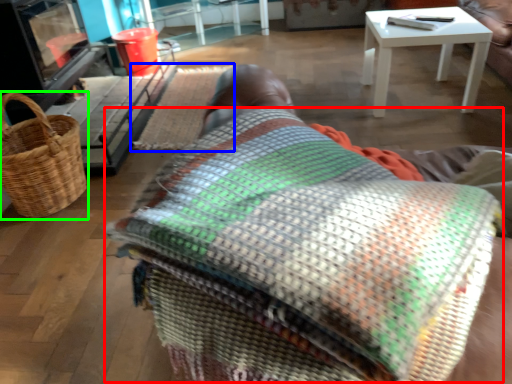
Question: Estimate the real-world distances between objects in this image. Which object is closer to blanket (highlighted by a red box), mat (highlighted by a blue box) or picnic basket (highlighted by a green box)?

Choices:
 (A) mat
 (B) picnic basket

Answer: (B)